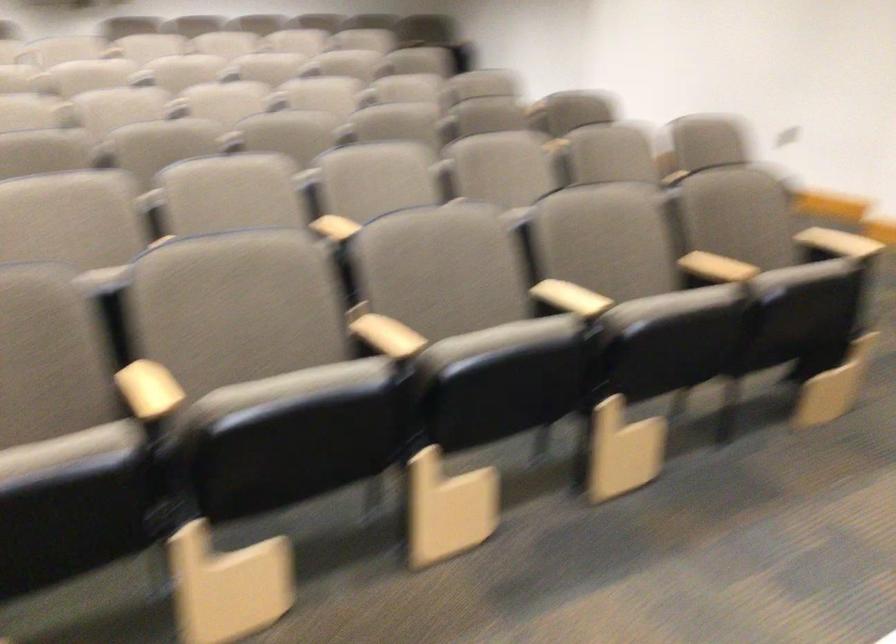
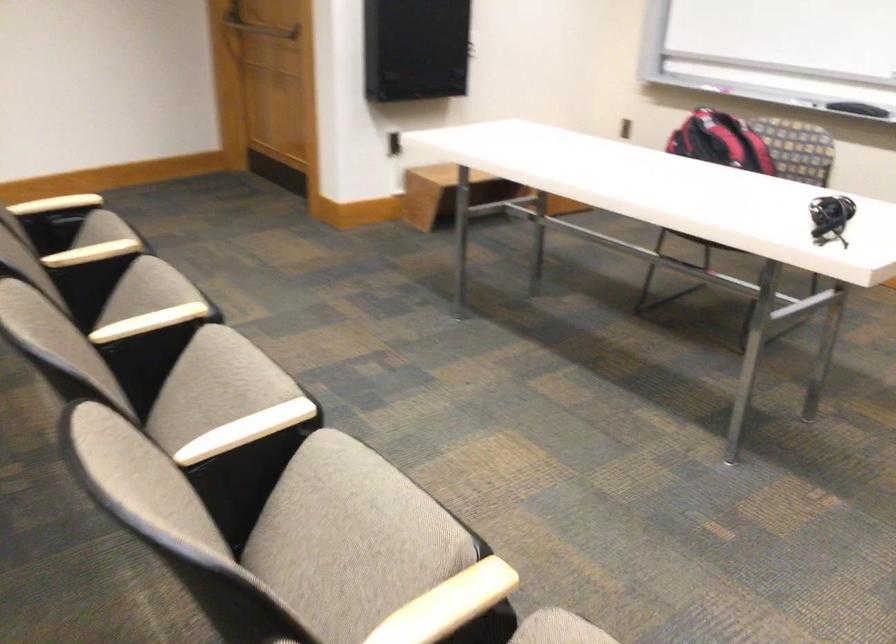
Locate, in the second image, the point that corresponds to [492,346] in the first image.

(214, 386)